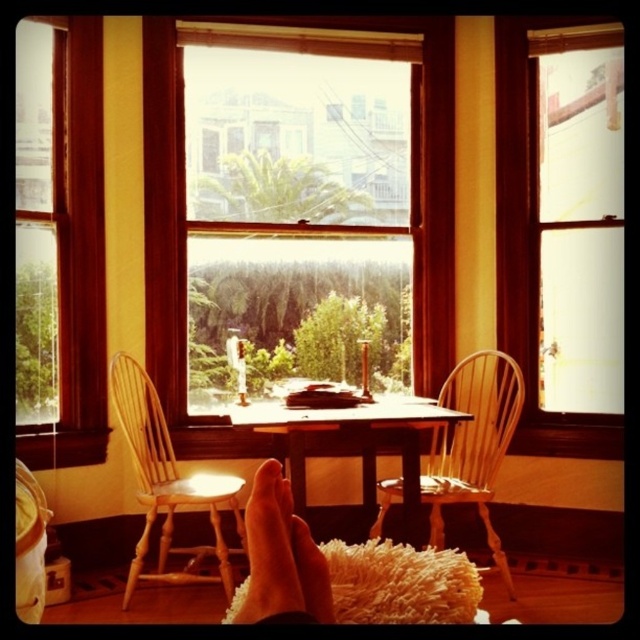
Who is shorter, light brown wooden chair at center or skinny flesh-toned foot at lower center?

skinny flesh-toned foot at lower center is shorter.

Which is below, light brown wooden chair at center or skinny flesh-toned foot at lower center?

light brown wooden chair at center is lower down.

Is point (134, 368) closer to viewer compared to point (253, 513)?

No.

At what (x,y) coordinates should I click in order to perform the action: click on light brown wooden chair at center. Please return your answer as a coordinate pair (x, y). The width and height of the screenshot is (640, 640). Looking at the image, I should click on (168, 483).

Does wooden frame window at center have a smaller size compared to light brown wooden chair at center?

Yes, wooden frame window at center is smaller than light brown wooden chair at center.

Which is behind, point (60, 54) or point (132, 433)?

Point (60, 54)

Identify the location of wooden frame window at center. The height and width of the screenshot is (640, 640). (77, 260).

Does point (161, 385) lie behind point (284, 493)?

Yes, point (161, 385) is behind point (284, 493).

What do you see at coordinates (419, 177) in the screenshot?
I see `clear glass window at center` at bounding box center [419, 177].

Who is more distant from viewer, (429, 189) or (276, 557)?

Positioned behind is point (429, 189).

Locate an element on the screen. This screenshot has width=640, height=640. clear glass window at center is located at coordinates (419, 177).